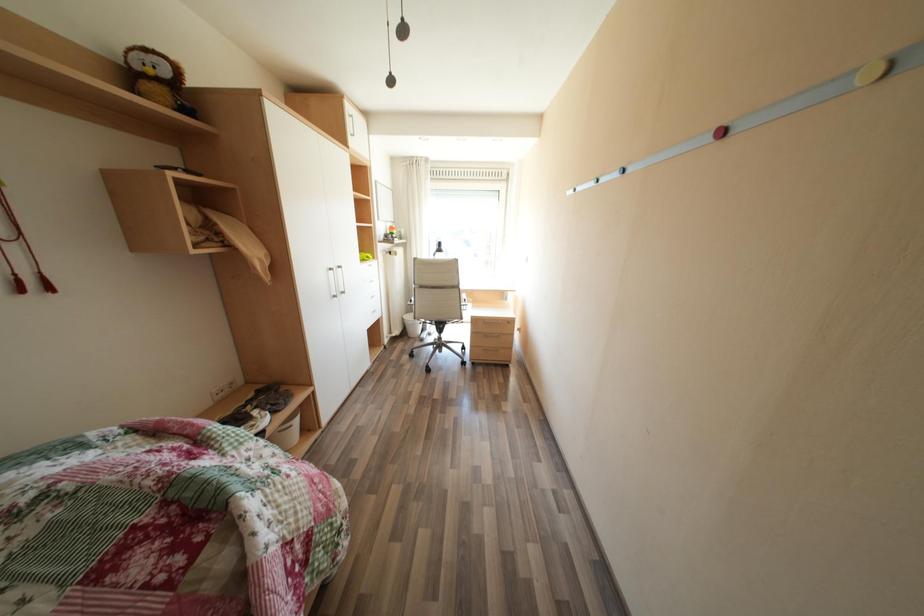
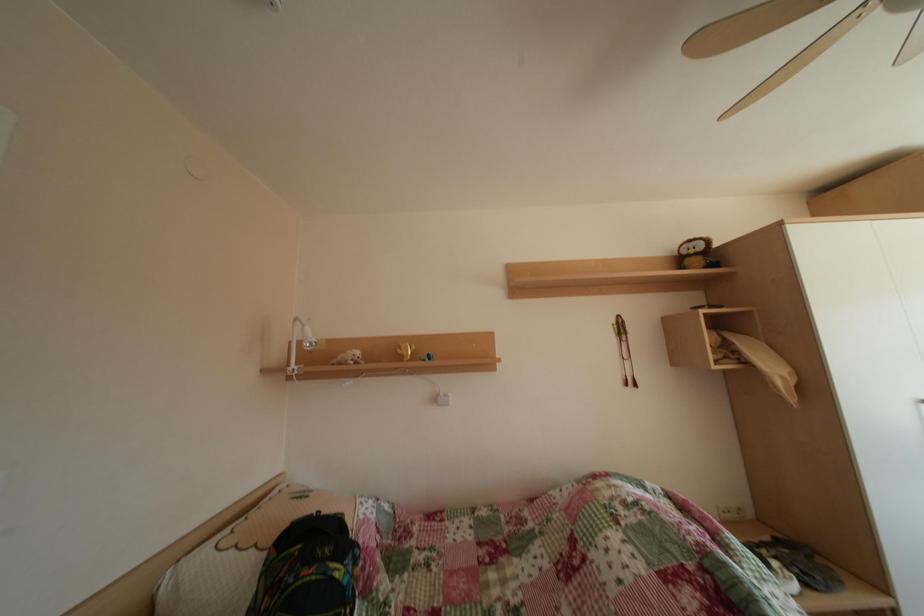
Question: The camera is either moving clockwise (left) or counter-clockwise (right) around the object. The first image is from the beginning of the video and the second image is from the end. Is the camera moving left or right when shooting the video?

Choices:
 (A) Left
 (B) Right

Answer: (B)